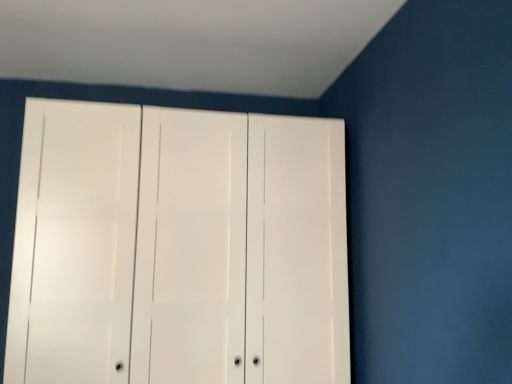
The height and width of the screenshot is (384, 512). Find the location of `white glossy cupboard at upper center`. white glossy cupboard at upper center is located at coordinates (178, 248).

Measure the distance between point (84, 247) and camera.

Point (84, 247) is 6.11 feet away from camera.

This screenshot has height=384, width=512. Describe the element at coordinates (178, 248) in the screenshot. I see `white glossy cupboard at upper center` at that location.

This screenshot has height=384, width=512. What are the coordinates of `white glossy cupboard at upper center` in the screenshot? It's located at (178, 248).